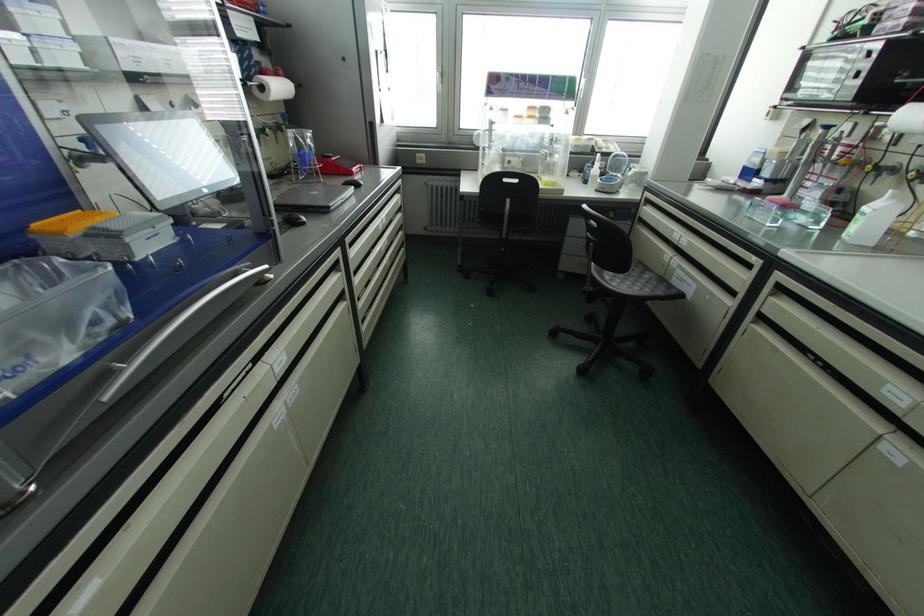
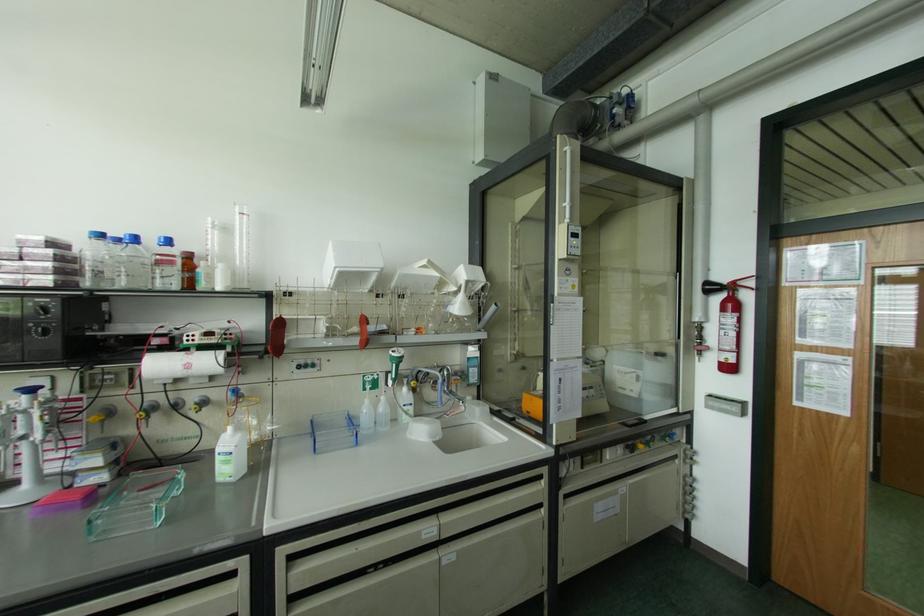
The point at (856, 75) is marked in the first image. Where is the corresponding point in the second image?

(44, 333)